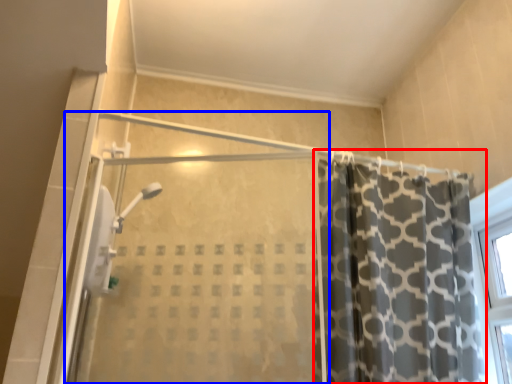
Question: Which point is closer to the camera, curtain (highlighted by a red box) or screen door (highlighted by a blue box)?

Choices:
 (A) curtain
 (B) screen door

Answer: (B)